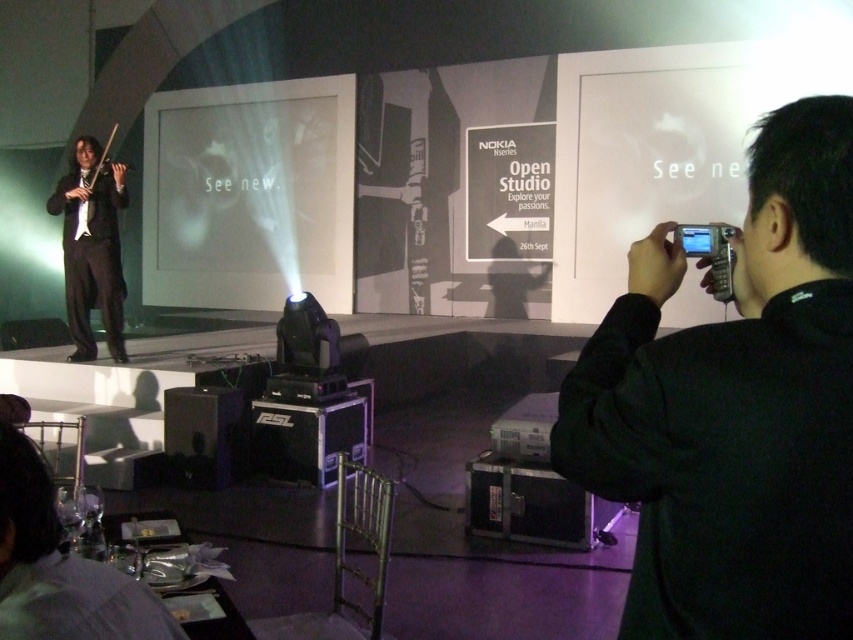
Who is positioned more to the right, black fabric camera at right or matte black suit at left?

From the viewer's perspective, black fabric camera at right appears more on the right side.

Identify the location of black fabric camera at right. This screenshot has height=640, width=853. (735, 408).

Can you confirm if white matte projection screen at center is shorter than black plastic speaker at lower center?

Incorrect, white matte projection screen at center's height does not fall short of black plastic speaker at lower center's.

What do you see at coordinates (248, 195) in the screenshot? I see `white matte projection screen at center` at bounding box center [248, 195].

I want to click on white matte projection screen at center, so click(x=248, y=195).

Which is more to the right, white matte projection screen at center or matte black suit at left?

From the viewer's perspective, matte black suit at left appears more on the right side.

Which is in front, point (271, 259) or point (91, 276)?

Point (91, 276) is in front.

Between point (276, 173) and point (73, 209), which one is positioned behind?

Point (276, 173)

At what (x,y) coordinates should I click in order to perform the action: click on white matte projection screen at center. Please return your answer as a coordinate pair (x, y). The width and height of the screenshot is (853, 640). Looking at the image, I should click on (248, 195).